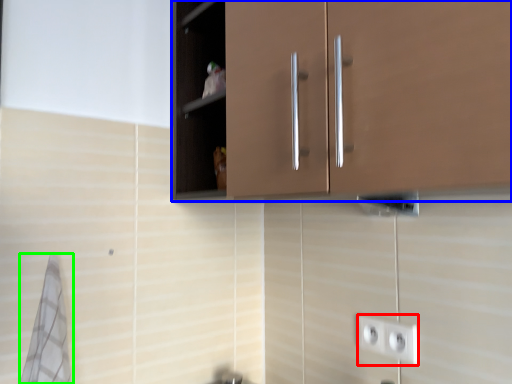
Question: Estimate the real-world distances between objects in this image. Which object is closer to socket (highlighted by a red box), cabinetry (highlighted by a blue box) or bath towel (highlighted by a green box)?

Choices:
 (A) cabinetry
 (B) bath towel

Answer: (A)